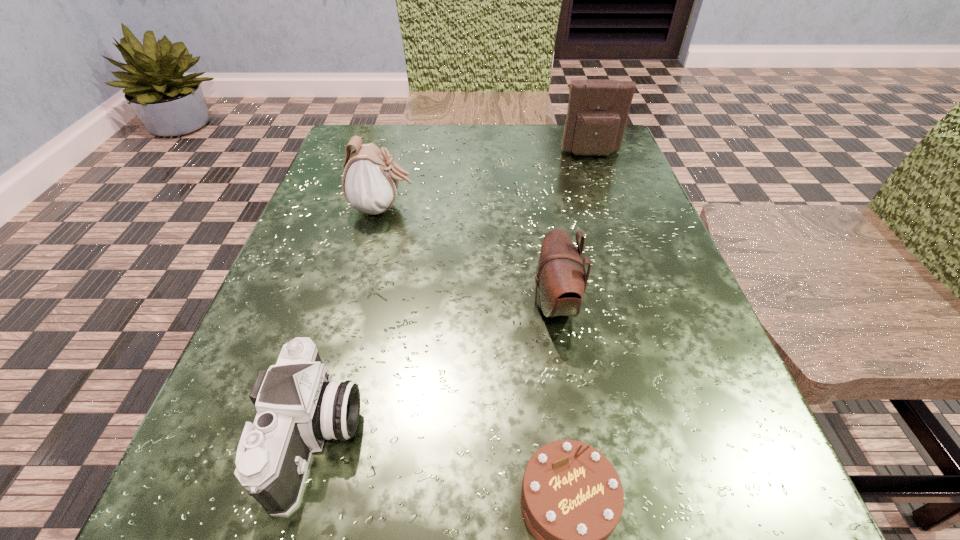
Find the location of a particular element. The height and width of the screenshot is (540, 960). the rightmost object is located at coordinates (597, 114).

Find the location of `the farthest pouch`. the farthest pouch is located at coordinates (597, 114).

Identify the location of the fourth nearest object. (370, 181).

Locate an element on the screen. the second farthest pouch is located at coordinates (370, 181).

The height and width of the screenshot is (540, 960). Identify the location of the nearest pouch. (561, 281).

In order to click on the third farthest object in this screenshot , I will do `click(561, 281)`.

At what (x,y) coordinates should I click in order to perform the action: click on camera. Please return your answer as a coordinate pair (x, y). Image resolution: width=960 pixels, height=540 pixels. Looking at the image, I should click on (298, 406).

This screenshot has width=960, height=540. Identify the location of free space located 0.100m with an open flap on the farthest object. (603, 186).

The height and width of the screenshot is (540, 960). I want to click on free space located 0.160m on the front-facing side of the second farthest pouch, so click(502, 208).

At what (x,y) coordinates should I click in order to perform the action: click on vacant space positioned 0.100m with the flap open on the nearest pouch. Please return your answer as a coordinate pair (x, y). The width and height of the screenshot is (960, 540). Looking at the image, I should click on (465, 303).